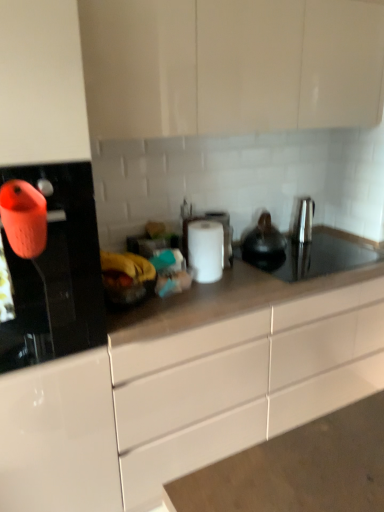
The image size is (384, 512). Describe the element at coordinates (241, 381) in the screenshot. I see `white glossy cabinet at center, marked as the first cabinetry in a bottom-to-top arrangement` at that location.

You are a GUI agent. You are given a task and a screenshot of the screen. Output one action in this format:
    pyautogui.click(x=<x>, y=<y>)
    Task: Click on the black matte tea pot at center
    
    Given the screenshot: What is the action you would take?
    pyautogui.click(x=264, y=245)

Image resolution: width=384 pixels, height=512 pixels. In order to click on white matte paper towel at center in this screenshot , I will do `click(205, 250)`.

In order to face white matte paper towel at center, should I rotate leftwards or rightwards?

You should look right and rotate roughly 1.800 degrees.

Measure the distance between black glass sink at center and camera.

A distance of 6.18 feet exists between black glass sink at center and camera.

The height and width of the screenshot is (512, 384). Describe the element at coordinates (231, 65) in the screenshot. I see `matte white cabinets at upper center, the 1th cabinetry from the top` at that location.

In order to face satin nickel faucet at right, should I rotate leftwards or rightwards?

Rotate right and turn 15.317 degrees.

This screenshot has height=512, width=384. What are the coordinates of `orange matte kettle at left` in the screenshot? It's located at (56, 274).

The height and width of the screenshot is (512, 384). Identify the location of white glossy cabinet at center, the 2th cabinetry from the top. coord(241,381).

Between orange matte kettle at left and white glossy cabinet at center, marked as the first cabinetry in a bottom-to-top arrangement, which one appears on the left side from the viewer's perspective?

orange matte kettle at left is more to the left.

Is orange matte kettle at left surrounding white glossy cabinet at center, the 2th cabinetry from the top?

No, white glossy cabinet at center, the 2th cabinetry from the top, is not a part of orange matte kettle at left.

What's the angular difference between orange matte kettle at left and white glossy cabinet at center, marked as the first cabinetry in a bottom-to-top arrangement,'s facing directions?

The facing directions of orange matte kettle at left and white glossy cabinet at center, marked as the first cabinetry in a bottom-to-top arrangement, are 0.000682 degrees apart.

Considering the points (36, 287) and (157, 471), which point is behind, point (36, 287) or point (157, 471)?

Point (157, 471)

Is point (304, 273) less distant than point (291, 226)?

That is True.

Is black glass sink at center inside the boundaries of satin nickel faucet at right, or outside?

black glass sink at center cannot be found inside satin nickel faucet at right.

Between orange matte kettle at left and white matte paper towel at center, which one appears on the right side from the viewer's perspective?

white matte paper towel at center.

In terms of width, does orange matte kettle at left look wider or thinner when compared to white matte paper towel at center?

Clearly, orange matte kettle at left has more width compared to white matte paper towel at center.

In order to click on paper towel behind the orange matte kettle at left in this screenshot , I will do `click(205, 250)`.

Can you confirm if orange matte kettle at left is bigger than white matte paper towel at center?

Yes.

Does black matte tea pot at center have a smaller size compared to orange matte kettle at left?

Correct, black matte tea pot at center occupies less space than orange matte kettle at left.

The width and height of the screenshot is (384, 512). Find the location of `kitchen appliance below the black matte tea pot at center (from the image's perspective)`. kitchen appliance below the black matte tea pot at center (from the image's perspective) is located at coordinates (56, 274).

Are black matte tea pot at center and orange matte kettle at left making contact?

black matte tea pot at center and orange matte kettle at left are clearly separated.

Which is nearer, (268, 264) or (113, 40)?

The point (113, 40) is more forward.

Would you say black matte tea pot at center is outside matte white cabinets at upper center, the 1th cabinetry from the top?

Yes.

Would you say black matte tea pot at center is a long distance from matte white cabinets at upper center, arranged as the 2th cabinetry when ordered from the bottom?

black matte tea pot at center is actually quite close to matte white cabinets at upper center, arranged as the 2th cabinetry when ordered from the bottom.

From a real-world perspective, does black matte tea pot at center stand above matte white cabinets at upper center, arranged as the 2th cabinetry when ordered from the bottom?

Actually, black matte tea pot at center is physically below matte white cabinets at upper center, arranged as the 2th cabinetry when ordered from the bottom, in the real world.

Between white matte paper towel at center and satin nickel faucet at right, which one has larger size?

With larger size is white matte paper towel at center.

From the image's perspective, which one is positioned higher, white matte paper towel at center or satin nickel faucet at right?

satin nickel faucet at right, from the image's perspective.

Is white matte paper towel at center positioned with its back to satin nickel faucet at right?

white matte paper towel at center does not have its back to satin nickel faucet at right.

Is white matte paper towel at center in front of or behind satin nickel faucet at right in the image?

white matte paper towel at center is positioned closer to the viewer than satin nickel faucet at right.

Between matte white cabinets at upper center, arranged as the 2th cabinetry when ordered from the bottom, and black glass sink at center, which one has smaller size?

black glass sink at center is smaller.

Is matte white cabinets at upper center, the 1th cabinetry from the top, to the left or to the right of black glass sink at center in the image?

Clearly, matte white cabinets at upper center, the 1th cabinetry from the top, is on the left of black glass sink at center in the image.

Looking at their sizes, would you say matte white cabinets at upper center, arranged as the 2th cabinetry when ordered from the bottom, is wider or thinner than black glass sink at center?

Clearly, matte white cabinets at upper center, arranged as the 2th cabinetry when ordered from the bottom, has less width compared to black glass sink at center.

Image resolution: width=384 pixels, height=512 pixels. What are the coordinates of `kitchen appliance located in front of the white glossy cabinet at center, marked as the first cabinetry in a bottom-to-top arrangement` in the screenshot? It's located at [x=56, y=274].

Identify the location of sink lying below the satin nickel faucet at right (from the image's perspective). The width and height of the screenshot is (384, 512). (302, 252).

Looking at the image, which one is located further to white matte paper towel at center, black matte tea pot at center or black glass sink at center?

black glass sink at center lies further to white matte paper towel at center than the other object.

When comparing their distances from white glossy cabinet at center, marked as the first cabinetry in a bottom-to-top arrangement, does orange matte kettle at left or white matte paper towel at center seem closer?

white matte paper towel at center is positioned closer to the anchor white glossy cabinet at center, marked as the first cabinetry in a bottom-to-top arrangement.

Based on their spatial positions, is black matte tea pot at center or white matte paper towel at center closer to white glossy cabinet at center, the 2th cabinetry from the top?

white matte paper towel at center is positioned closer to the anchor white glossy cabinet at center, the 2th cabinetry from the top.

Considering their positions, is matte white cabinets at upper center, the 1th cabinetry from the top, positioned further to white matte paper towel at center than satin nickel faucet at right?

matte white cabinets at upper center, the 1th cabinetry from the top.

Looking at the image, which one is located further to matte white cabinets at upper center, the 1th cabinetry from the top, white glossy cabinet at center, marked as the first cabinetry in a bottom-to-top arrangement, or black glass sink at center?

white glossy cabinet at center, marked as the first cabinetry in a bottom-to-top arrangement.

From the image, which object appears to be farther from orange matte kettle at left, black glass sink at center or white matte paper towel at center?

Based on the image, black glass sink at center appears to be further to orange matte kettle at left.

Looking at the image, which one is located further to white glossy cabinet at center, marked as the first cabinetry in a bottom-to-top arrangement, orange matte kettle at left or satin nickel faucet at right?

satin nickel faucet at right is further to white glossy cabinet at center, marked as the first cabinetry in a bottom-to-top arrangement.

Considering their positions, is black glass sink at center positioned further to matte white cabinets at upper center, arranged as the 2th cabinetry when ordered from the bottom, than white glossy cabinet at center, the 2th cabinetry from the top?

Based on the image, white glossy cabinet at center, the 2th cabinetry from the top, appears to be further to matte white cabinets at upper center, arranged as the 2th cabinetry when ordered from the bottom.

The width and height of the screenshot is (384, 512). What are the coordinates of `tea pot between orange matte kettle at left and satin nickel faucet at right along the z-axis` in the screenshot? It's located at pos(264,245).

This screenshot has width=384, height=512. Identify the location of paper towel between matte white cabinets at upper center, arranged as the 2th cabinetry when ordered from the bottom, and white glossy cabinet at center, the 2th cabinetry from the top, vertically. (205, 250).

The width and height of the screenshot is (384, 512). Identify the location of sink between matte white cabinets at upper center, the 1th cabinetry from the top, and satin nickel faucet at right, along the z-axis. (302, 252).

Identify the location of tea pot between matte white cabinets at upper center, the 1th cabinetry from the top, and black glass sink at center from top to bottom. The height and width of the screenshot is (512, 384). (x=264, y=245).